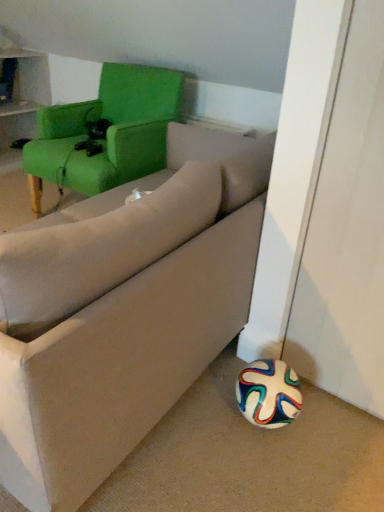
Question: Considering the relative positions of beige fabric pillow at center and green fabric chair at upper left in the image provided, is beige fabric pillow at center to the right of green fabric chair at upper left from the viewer's perspective?

Choices:
 (A) yes
 (B) no

Answer: (A)

Question: Can green fabric chair at upper left be found inside beige fabric pillow at center?

Choices:
 (A) no
 (B) yes

Answer: (A)

Question: From the image's perspective, is beige fabric pillow at center under green fabric chair at upper left?

Choices:
 (A) no
 (B) yes

Answer: (B)

Question: Could you tell me if beige fabric pillow at center is turned towards green fabric chair at upper left?

Choices:
 (A) yes
 (B) no

Answer: (B)

Question: Is beige fabric pillow at center smaller than green fabric chair at upper left?

Choices:
 (A) no
 (B) yes

Answer: (B)

Question: Is beige fabric couch at lower right in front of or behind green fabric chair at upper left in the image?

Choices:
 (A) front
 (B) behind

Answer: (A)

Question: From the image's perspective, is beige fabric couch at lower right positioned above or below green fabric chair at upper left?

Choices:
 (A) below
 (B) above

Answer: (A)

Question: Is beige fabric couch at lower right situated inside green fabric chair at upper left or outside?

Choices:
 (A) outside
 (B) inside

Answer: (A)

Question: Looking at their shapes, would you say beige fabric couch at lower right is wider or thinner than green fabric chair at upper left?

Choices:
 (A) thin
 (B) wide

Answer: (B)

Question: Considering their positions, is beige fabric pillow at center located in front of or behind green fabric chair at upper left?

Choices:
 (A) front
 (B) behind

Answer: (A)

Question: Is point (13, 304) closer or farther from the camera than point (26, 160)?

Choices:
 (A) closer
 (B) farther

Answer: (A)

Question: From a real-world perspective, relative to green fabric chair at upper left, is beige fabric pillow at center vertically above or below?

Choices:
 (A) above
 (B) below

Answer: (A)

Question: Is beige fabric pillow at center to the left or to the right of green fabric chair at upper left in the image?

Choices:
 (A) left
 (B) right

Answer: (B)

Question: From their relative heights in the image, would you say beige fabric pillow at center is taller or shorter than beige fabric couch at lower right?

Choices:
 (A) tall
 (B) short

Answer: (A)

Question: From the image's perspective, is beige fabric pillow at center located above or below beige fabric couch at lower right?

Choices:
 (A) above
 (B) below

Answer: (B)